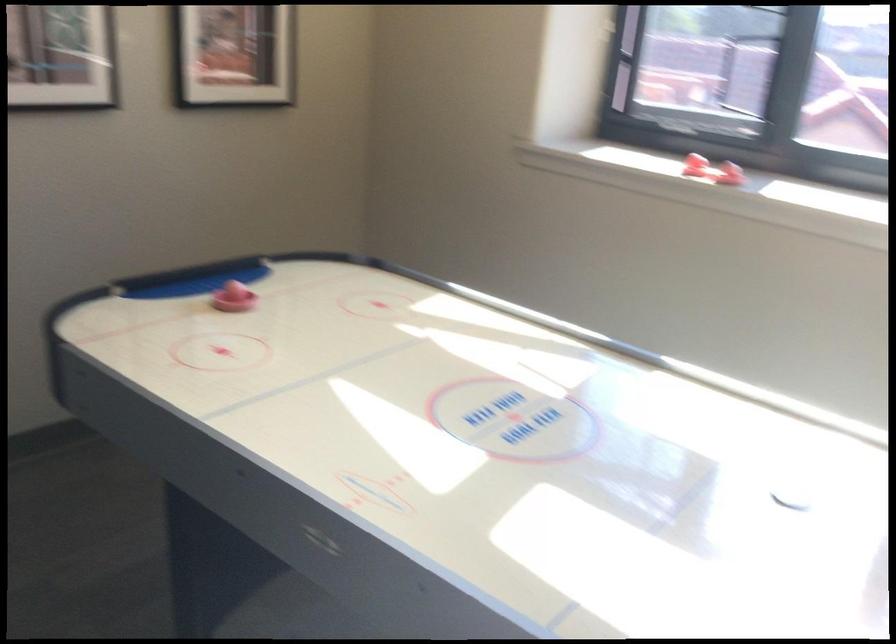
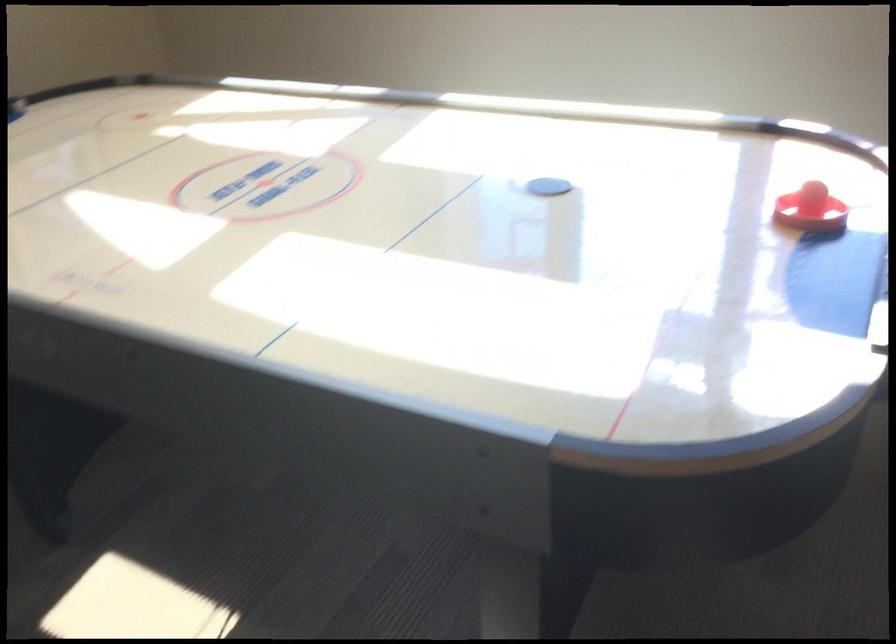
Question: The images are taken continuously from a first-person perspective. In which direction are you moving?

Choices:
 (A) Left
 (B) Right
 (C) Forward
 (D) Backward

Answer: (B)